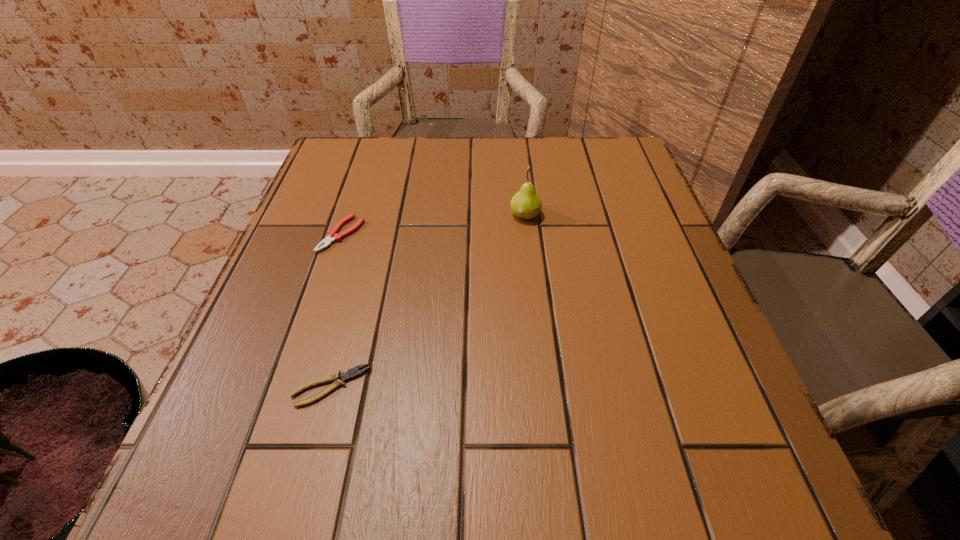
At what (x,y) coordinates should I click in order to perform the action: click on unoccupied area between the pear and the shorter pliers. Please return your answer as a coordinate pair (x, y). The image size is (960, 540). Looking at the image, I should click on (428, 300).

I want to click on free spot between the shortest object and the taller pliers, so click(336, 310).

Find the location of a particular element. free area in between the shortest object and the second tallest object is located at coordinates (336, 310).

Locate an element on the screen. The image size is (960, 540). free space that is in between the pear and the shorter pliers is located at coordinates (428, 300).

What are the coordinates of `vacant space in between the shorter pliers and the rightmost object` in the screenshot? It's located at (428, 300).

In order to click on object that is the closest to the nearest object in this screenshot , I will do `click(332, 235)`.

Identify which object is the nearest to the nearest object. Please provide its 2D coordinates. Your answer should be formatted as a tuple, i.e. [(x, y)], where the tuple contains the x and y coordinates of a point satisfying the conditions above.

[(332, 235)]

In order to click on vacant region that satisfies the following two spatial constraints: 1. on the back side of the pear; 2. on the left side of the taller pliers in this screenshot , I will do `click(348, 214)`.

The height and width of the screenshot is (540, 960). Identify the location of vacant area in the image that satisfies the following two spatial constraints: 1. on the front side of the shortest object; 2. on the left side of the taller pliers. (291, 386).